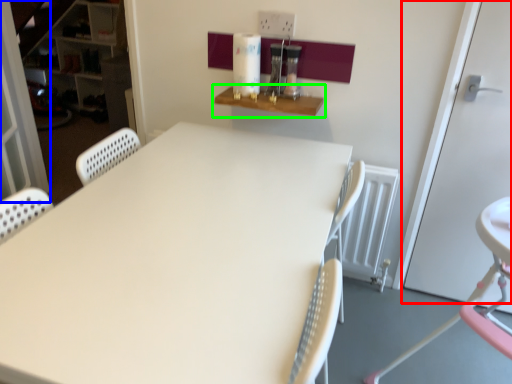
Question: Which object is positioned farthest from door (highlighted by a red box)? Select from screen door (highlighted by a blue box) and shelf (highlighted by a green box).

Choices:
 (A) screen door
 (B) shelf

Answer: (A)